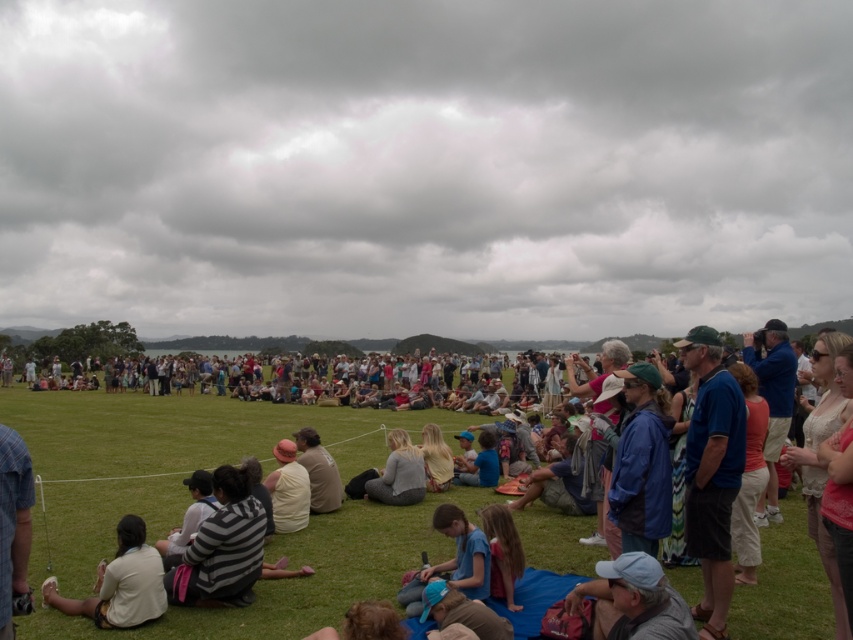
Between point (190, 557) and point (149, 604), which one is positioned in front?

Point (149, 604) is more forward.

Does point (178, 600) come farther from viewer compared to point (119, 547)?

Yes.

I want to click on striped sweater at center, so click(222, 547).

Between white cotton shirt at center and white casual clothing at center, which one has less height?

With less height is white cotton shirt at center.

Image resolution: width=853 pixels, height=640 pixels. Identify the location of white cotton shirt at center. (163, 458).

Which is in front, point (140, 518) or point (494, 544)?

Point (494, 544) is in front.

Which is more to the left, light beige shirt at lower left or light brown hair at lower center?

light beige shirt at lower left is more to the left.

The image size is (853, 640). What do you see at coordinates (120, 582) in the screenshot? I see `light beige shirt at lower left` at bounding box center [120, 582].

You are a GUI agent. You are given a task and a screenshot of the screen. Output one action in this format:
    pyautogui.click(x=<x>, y=<y>)
    Task: Click on the light beige shirt at lower left
    The width and height of the screenshot is (853, 640).
    Given the screenshot: What is the action you would take?
    (x=120, y=582)